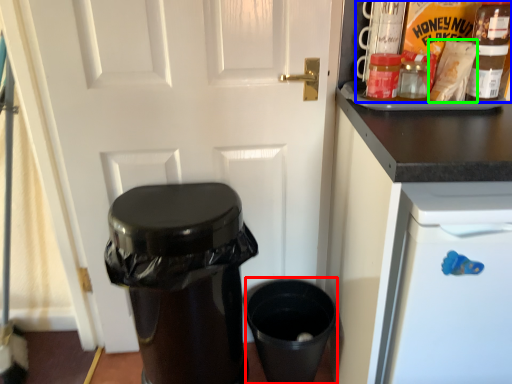
Question: Considering the real-world distances, which object is closest to appliance (highlighted by a red box)? food (highlighted by a blue box) or food (highlighted by a green box).

Choices:
 (A) food
 (B) food

Answer: (B)